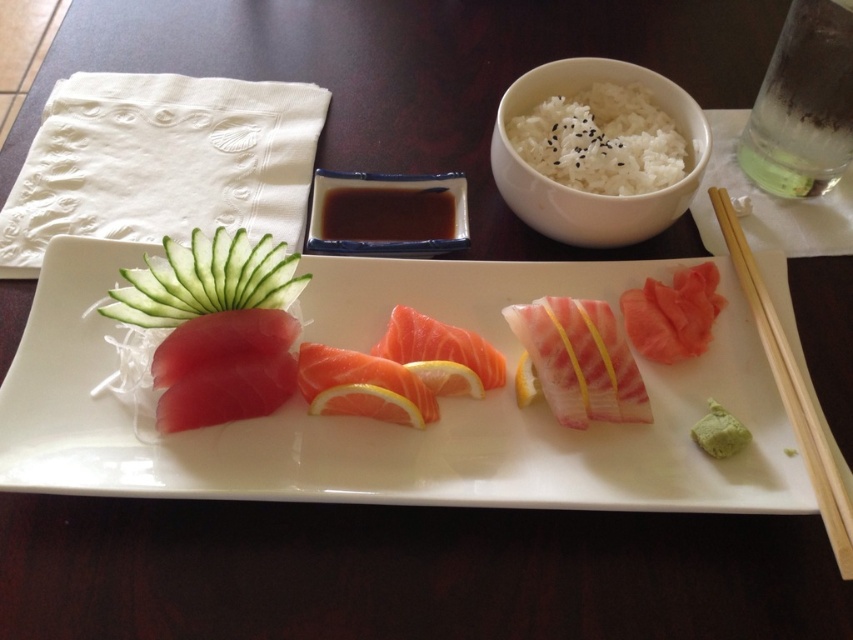
Question: Considering the real-world distances, which object is farthest from the pink raw fish at center?

Choices:
 (A) sashimi plate at center
 (B) pink glossy salmon at center
 (C) green smooth cucumber at left

Answer: (C)

Question: From the image, what is the correct spatial relationship of sashimi plate at center in relation to green paste at bottom right?

Choices:
 (A) below
 (B) above

Answer: (B)

Question: Which object is closer to the camera taking this photo?

Choices:
 (A) pink raw fish at center
 (B) sashimi plate at center

Answer: (B)

Question: Does pink glossy salmon at center lie behind green paste at bottom right?

Choices:
 (A) no
 (B) yes

Answer: (B)

Question: Which object appears farthest from the camera in this image?

Choices:
 (A) green smooth cucumber at left
 (B) pink glossy salmon at center
 (C) pink raw salmon at center
 (D) white matte rice bowl at upper center

Answer: (D)

Question: Where is wooden chopsticks at lower right located in relation to green paste at bottom right in the image?

Choices:
 (A) left
 (B) right

Answer: (B)